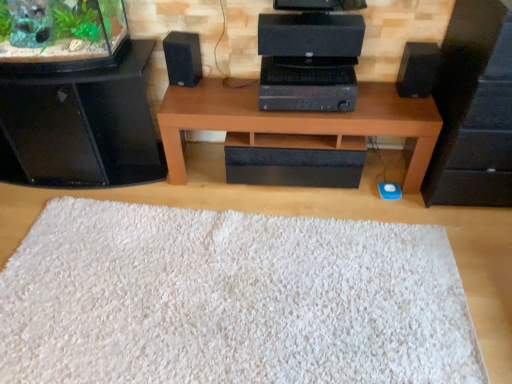
Describe the element at coordinates (183, 58) in the screenshot. I see `black matte speaker at left, placed as the first speaker when sorted from left to right` at that location.

Measure the distance between black matte speaker at left, placed as the first speaker when sorted from left to right, and camera.

black matte speaker at left, placed as the first speaker when sorted from left to right, and camera are 6.75 feet apart.

This screenshot has height=384, width=512. Find the location of `black matte speaker at right, marked as the 1th speaker in a right-to-left arrangement`. black matte speaker at right, marked as the 1th speaker in a right-to-left arrangement is located at coordinates (417, 69).

The width and height of the screenshot is (512, 384). What are the coordinates of `green matte plant at upper left` in the screenshot? It's located at (59, 27).

I want to click on mat in front of the black matte speaker at right, marked as the 1th speaker in a right-to-left arrangement, so click(x=231, y=300).

From a real-world perspective, is black matte speaker at right, marked as the 1th speaker in a right-to-left arrangement, physically located above or below white shaggy rug at center?

black matte speaker at right, marked as the 1th speaker in a right-to-left arrangement, is above white shaggy rug at center.

Based on the photo, can you confirm if black matte speaker at right, the 2th speaker viewed from the left, is bigger than white shaggy rug at center?

No.

From a real-world perspective, between black matte speaker at left, placed as the first speaker when sorted from left to right, and black matte speaker at right, marked as the 1th speaker in a right-to-left arrangement, who is vertically lower?

From a 3D spatial view, black matte speaker at right, marked as the 1th speaker in a right-to-left arrangement, is below.

From the image's perspective, which is below, black matte speaker at left, the second speaker when ordered from right to left, or black matte speaker at right, marked as the 1th speaker in a right-to-left arrangement?

black matte speaker at right, marked as the 1th speaker in a right-to-left arrangement, appears lower in the image.

Image resolution: width=512 pixels, height=384 pixels. In the image, there is a black matte speaker at left, placed as the first speaker when sorted from left to right. Find the location of `speaker below it (from the image's perspective)`. speaker below it (from the image's perspective) is located at coordinates (417, 69).

Is black matte speaker at left, placed as the first speaker when sorted from left to right, directly adjacent to black matte speaker at right, the 2th speaker viewed from the left?

No, black matte speaker at left, placed as the first speaker when sorted from left to right, is not with black matte speaker at right, the 2th speaker viewed from the left.

From the picture: Does black glossy speaker at left, arranged as the 1th furniture when viewed from the left, have a larger size compared to black matte speaker at right, the second furniture from the left?

No.

Is black glossy speaker at left, arranged as the 1th furniture when viewed from the left, positioned with its back to black matte speaker at right, the second furniture from the left?

No, black glossy speaker at left, arranged as the 1th furniture when viewed from the left, is not facing the opposite direction of black matte speaker at right, the second furniture from the left.

Would you say black glossy speaker at left, which appears as the second furniture when viewed from the right, is inside or outside black matte speaker at right, the 1th furniture from the right?

The correct answer is: outside.

Which is more to the left, black glossy speaker at left, which appears as the second furniture when viewed from the right, or black matte speaker at right, the 1th furniture from the right?

black glossy speaker at left, which appears as the second furniture when viewed from the right.

Would you say black matte speaker at center is part of white shaggy rug at center's contents?

Definitely not — black matte speaker at center is not inside white shaggy rug at center.

Is point (426, 279) less distant than point (273, 31)?

No.

Consider the image. From the image's perspective, which one is positioned lower, white shaggy rug at center or black matte speaker at center?

From the image's view, white shaggy rug at center is below.

From a real-world perspective, which object rests below the other?

white shaggy rug at center, from a real-world perspective.

From the image's perspective, relative to black matte speaker at right, the second furniture from the left, is black matte speaker at center above or below?

black matte speaker at center is above black matte speaker at right, the second furniture from the left.

Who is bigger, black matte speaker at center or black matte speaker at right, the 1th furniture from the right?

With larger size is black matte speaker at right, the 1th furniture from the right.

Can we say black matte speaker at center lies outside black matte speaker at right, the second furniture from the left?

black matte speaker at center lies outside black matte speaker at right, the second furniture from the left,'s area.

Is black matte speaker at center behind black matte speaker at right, the 1th furniture from the right?

Yes.

Is white shaggy rug at center to the right of black matte speaker at right, marked as the 1th speaker in a right-to-left arrangement, from the viewer's perspective?

No, white shaggy rug at center is not to the right of black matte speaker at right, marked as the 1th speaker in a right-to-left arrangement.

Between white shaggy rug at center and black matte speaker at right, the 2th speaker viewed from the left, which one has less height?

Standing shorter between the two is white shaggy rug at center.

Is white shaggy rug at center inside the boundaries of black matte speaker at right, marked as the 1th speaker in a right-to-left arrangement, or outside?

white shaggy rug at center cannot be found inside black matte speaker at right, marked as the 1th speaker in a right-to-left arrangement.

Between white shaggy rug at center and black matte speaker at right, the 2th speaker viewed from the left, which one has larger size?

Bigger between the two is white shaggy rug at center.

Considering the relative positions of black matte speaker at center and white shaggy rug at center in the image provided, is black matte speaker at center to the left or to the right of white shaggy rug at center?

In the image, black matte speaker at center appears on the right side of white shaggy rug at center.

Can you confirm if black matte speaker at center is bigger than white shaggy rug at center?

Incorrect, black matte speaker at center is not larger than white shaggy rug at center.

How distant is black matte speaker at center from white shaggy rug at center?

black matte speaker at center and white shaggy rug at center are 33.97 inches apart.

Who is more distant, black matte speaker at center or white shaggy rug at center?

black matte speaker at center is further from the camera.

From the white shaggy rug at center, count 1st speakers backward and point to it. Please provide its 2D coordinates.

[(417, 69)]

The height and width of the screenshot is (384, 512). I want to click on speaker below the black matte speaker at left, placed as the first speaker when sorted from left to right (from the image's perspective), so click(417, 69).

Looking at the image, which one is located closer to black matte speaker at center, brown wood table at center or white shaggy rug at center?

brown wood table at center lies closer to black matte speaker at center than the other object.

When comparing their distances from black matte speaker at left, placed as the first speaker when sorted from left to right, does brown wood table at center or black glossy speaker at left, arranged as the 1th furniture when viewed from the left, seem closer?

brown wood table at center is closer to black matte speaker at left, placed as the first speaker when sorted from left to right.

Estimate the real-world distances between objects in this image. Which object is closer to black matte speaker at right, the second furniture from the left, black matte speaker at left, placed as the first speaker when sorted from left to right, or white shaggy rug at center?

white shaggy rug at center lies closer to black matte speaker at right, the second furniture from the left, than the other object.

Based on their spatial positions, is brown wood table at center or white shaggy rug at center closer to black matte speaker at right, the 1th furniture from the right?

brown wood table at center lies closer to black matte speaker at right, the 1th furniture from the right, than the other object.

Considering their positions, is white shaggy rug at center positioned further to black matte speaker at right, the 1th furniture from the right, than black matte speaker at center?

white shaggy rug at center.

From the image, which object appears to be farther from black matte speaker at left, the second speaker when ordered from right to left, black glossy speaker at left, arranged as the 1th furniture when viewed from the left, or black matte speaker at right, the 1th furniture from the right?

black matte speaker at right, the 1th furniture from the right.

From the image, which object appears to be farther from brown wood table at center, black matte speaker at left, the second speaker when ordered from right to left, or black matte speaker at right, the 1th furniture from the right?

black matte speaker at right, the 1th furniture from the right, is positioned further to the anchor brown wood table at center.

Looking at the image, which one is located closer to brown wood table at center, black glossy speaker at left, which appears as the second furniture when viewed from the right, or black matte speaker at center?

Among the two, black matte speaker at center is located nearer to brown wood table at center.

This screenshot has width=512, height=384. What are the coordinates of `table situated between green matte plant at upper left and black matte speaker at right, marked as the 1th speaker in a right-to-left arrangement, from left to right` in the screenshot? It's located at (297, 120).

Where is `table between black matte speaker at center and white shaggy rug at center from top to bottom`? This screenshot has height=384, width=512. table between black matte speaker at center and white shaggy rug at center from top to bottom is located at coordinates (297, 120).

Locate an element on the screen. The image size is (512, 384). table between green matte plant at upper left and black matte speaker at center in the horizontal direction is located at coordinates (297, 120).

At what (x,y) coordinates should I click in order to perform the action: click on mat situated between green matte plant at upper left and black matte speaker at right, the 2th speaker viewed from the left, from left to right. Please return your answer as a coordinate pair (x, y). Looking at the image, I should click on point(231,300).